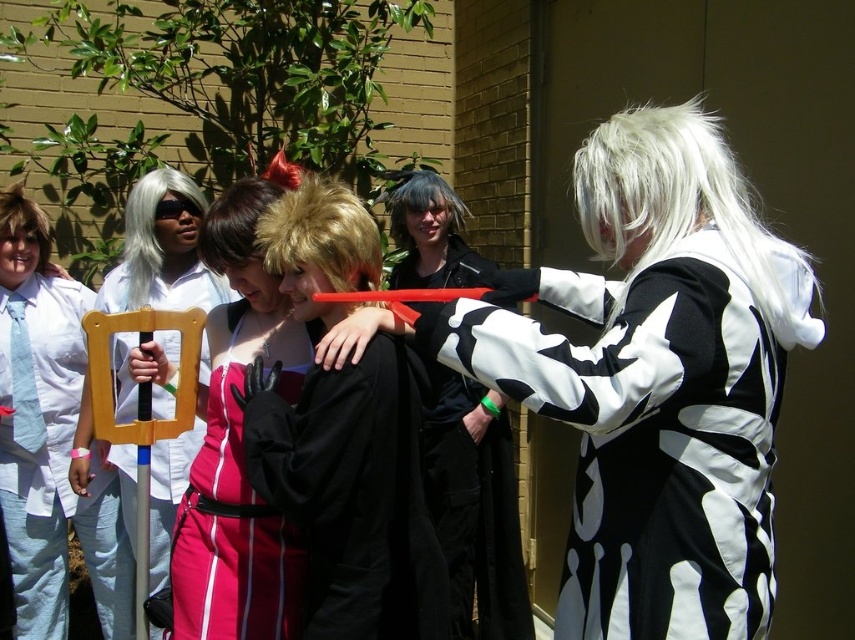
Question: Estimate the real-world distances between objects in this image. Which object is farther from the black matte robe at center?

Choices:
 (A) shiny brown wig at center
 (B) shiny black wig at center
 (C) blonde synthetic wig at left

Answer: (C)

Question: Is matte white wig at left thinner than blonde synthetic wig at left?

Choices:
 (A) yes
 (B) no

Answer: (B)

Question: Which point is farther to the camera?

Choices:
 (A) (410, 196)
 (B) (728, 221)
 (C) (152, 176)
 (D) (24, 212)

Answer: (A)

Question: Can you confirm if black matte robe at center is thinner than gray synthetic wig at upper left?

Choices:
 (A) yes
 (B) no

Answer: (B)

Question: Is black and white costume at center above white matte wig at upper right?

Choices:
 (A) yes
 (B) no

Answer: (B)

Question: Which point appears closest to the camera in this image?

Choices:
 (A) (255, 620)
 (B) (136, 296)
 (C) (411, 198)
 (D) (39, 259)

Answer: (A)